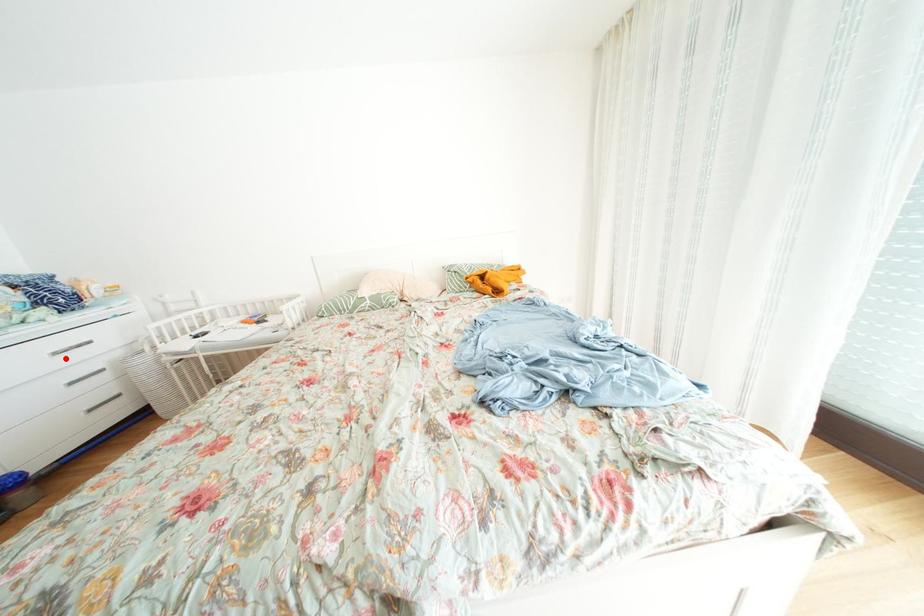
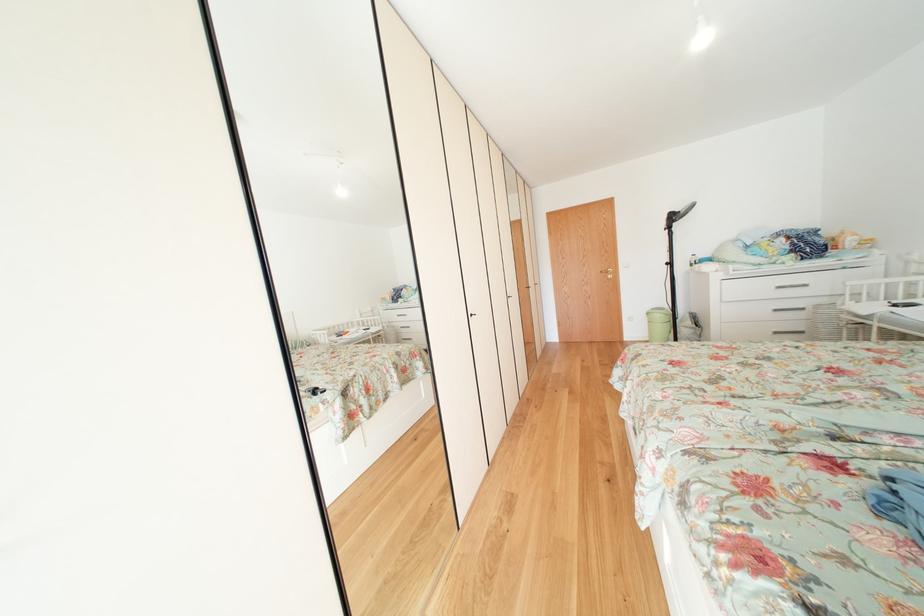
In the second image, find the point that corresponds to the highlighted location in the first image.

(787, 292)